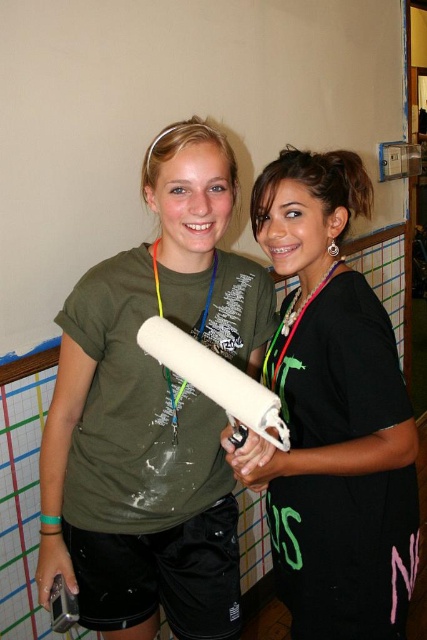
Can you confirm if black matte shirt at center is positioned below neon green fabric lanyard at center?

Yes.

Image resolution: width=427 pixels, height=640 pixels. I want to click on black matte shirt at center, so click(335, 413).

Where is `black matte shirt at center`? The width and height of the screenshot is (427, 640). black matte shirt at center is located at coordinates (335, 413).

Is point (151, 323) more distant than point (292, 333)?

No, it is in front of (292, 333).

Which is in front, point (213, 371) or point (315, 288)?

Point (213, 371) is more forward.

Image resolution: width=427 pixels, height=640 pixels. What are the coordinates of `white matte paint roller at center` in the screenshot? It's located at (216, 381).

Is matte green t-shirt at center thinner than black matte shirt at center?

No, matte green t-shirt at center is not thinner than black matte shirt at center.

Does point (160, 291) come closer to viewer compared to point (386, 372)?

That is False.

Identify the location of matte green t-shirt at center. (152, 412).